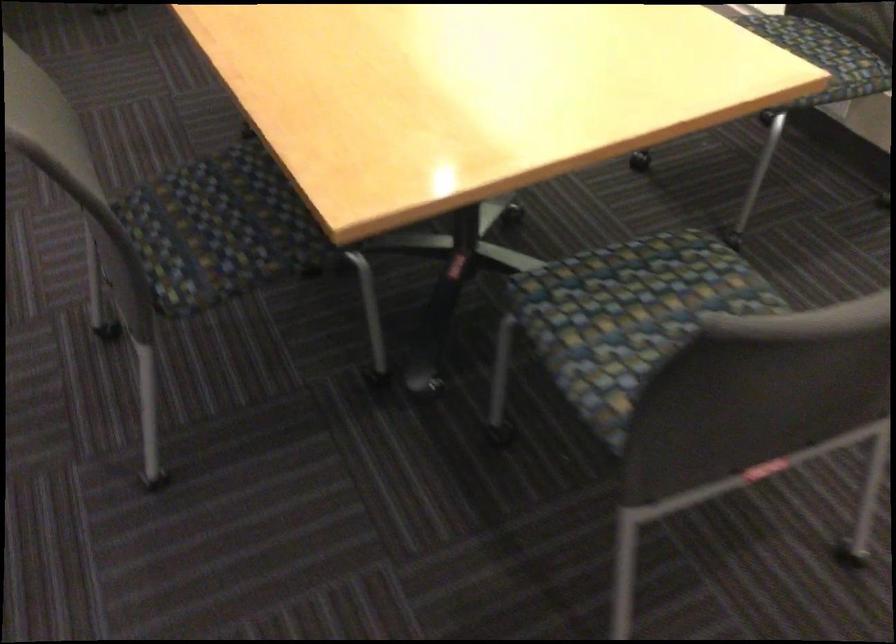
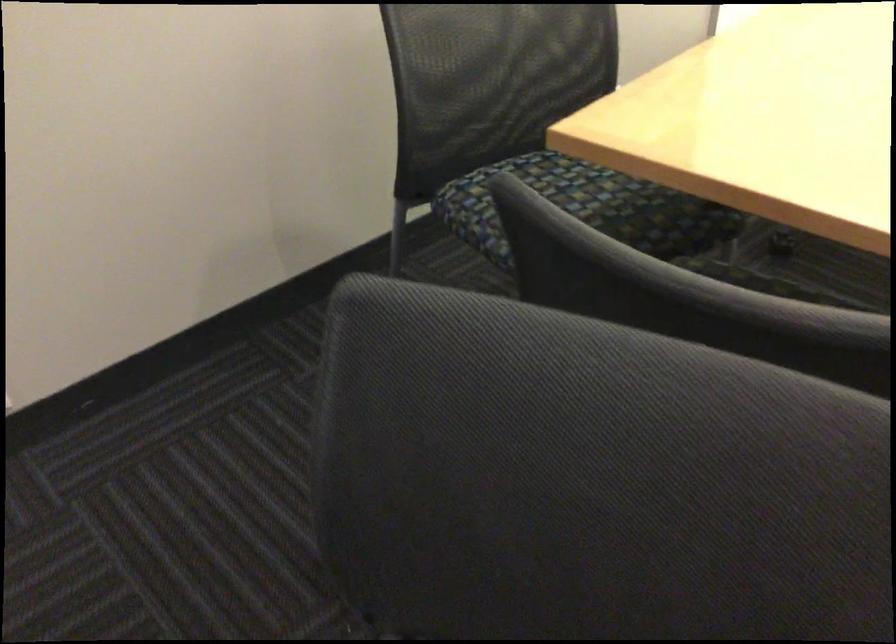
Which direction would the cameraman need to move to produce the second image?

The cameraman walked toward left, forward.